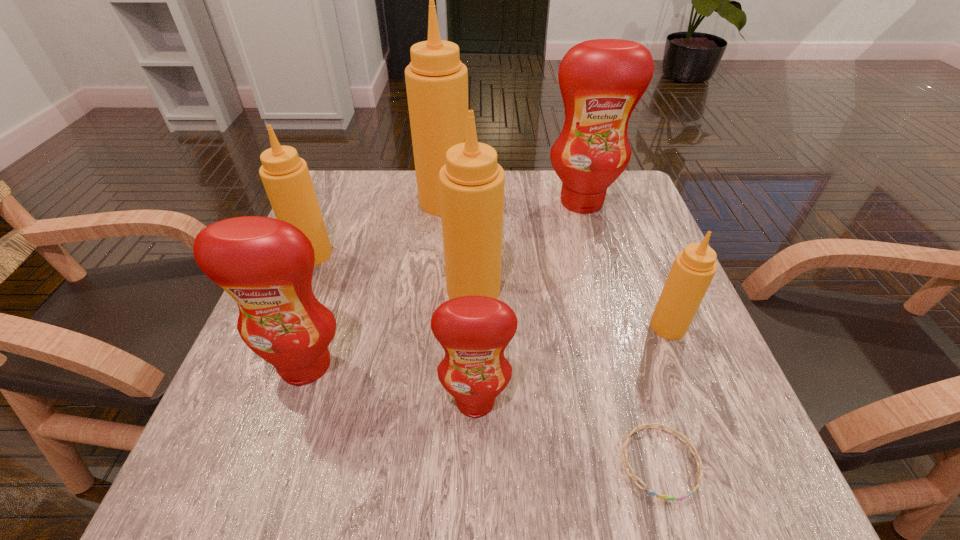
Locate an element on the screen. vacant point located 0.060m on the label side of the second red condiment from left to right is located at coordinates (474, 459).

Locate an element on the screen. object positioned at the near edge is located at coordinates [x=624, y=450].

Locate an element on the screen. The height and width of the screenshot is (540, 960). bracelet that is positioned at the right edge is located at coordinates (624, 450).

Identify the location of object located at the far right corner. (601, 81).

What are the coordinates of `object that is at the near right corner` in the screenshot? It's located at (624, 450).

You are a GUI agent. You are given a task and a screenshot of the screen. Output one action in this format:
    pyautogui.click(x=<x>, y=<y>)
    Task: Click on the free space at the far edge
    The image size is (960, 540).
    Given the screenshot: What is the action you would take?
    pyautogui.click(x=513, y=174)

This screenshot has width=960, height=540. In order to click on vacant space at the near edge in this screenshot , I will do `click(609, 469)`.

In the image, there is a desktop. Where is `blank space at the right edge`? blank space at the right edge is located at coordinates (653, 305).

Find the location of `vacant space at the far left corner`. vacant space at the far left corner is located at coordinates (376, 206).

Where is `vacant space at the near left corner of the desktop`? The height and width of the screenshot is (540, 960). vacant space at the near left corner of the desktop is located at coordinates (220, 468).